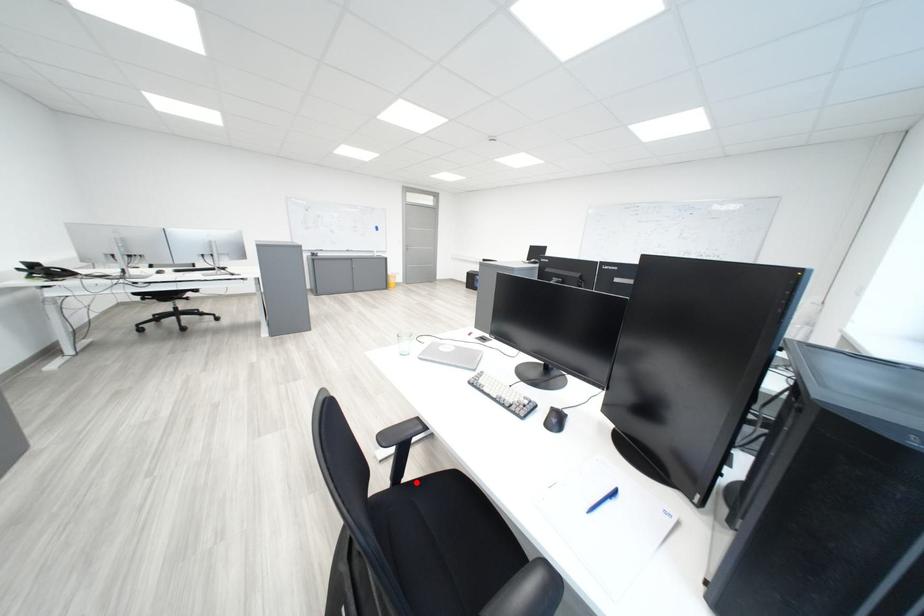
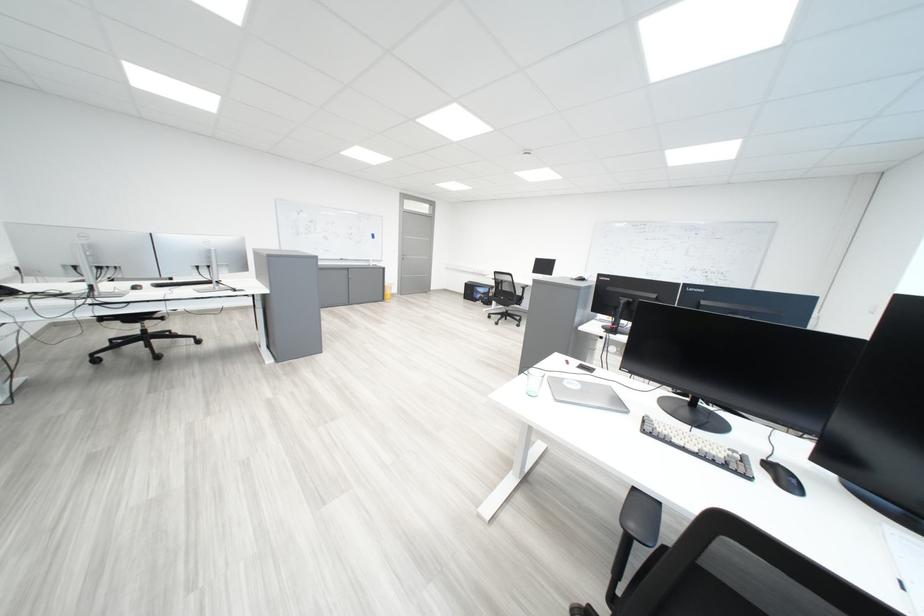
Question: I am providing you with two images of the same scene from different viewpoints. A red point is marked on the first image. Is the red point's position out of view in image 2?

Choices:
 (A) Yes
 (B) No

Answer: (A)